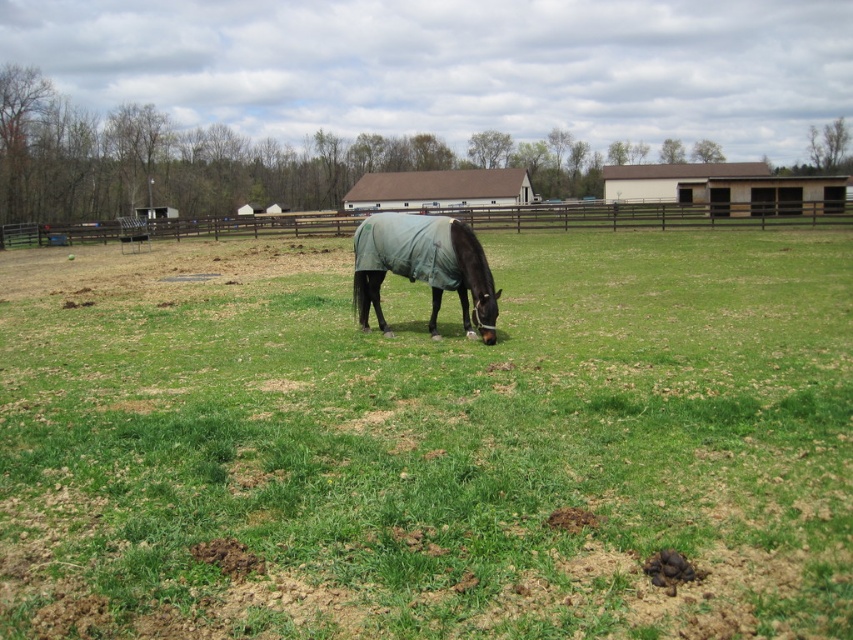
Question: Among these points, which one is nearest to the camera?

Choices:
 (A) [712, 268]
 (B) [364, 260]

Answer: (B)

Question: Which of the following is the closest to the observer?

Choices:
 (A) (494, 316)
 (B) (598, 349)

Answer: (B)

Question: Is green matte horse at center to the right of dark green fabric horse at center from the viewer's perspective?

Choices:
 (A) yes
 (B) no

Answer: (B)

Question: Does green matte horse at center have a lesser width compared to dark green fabric horse at center?

Choices:
 (A) yes
 (B) no

Answer: (B)

Question: From the image, what is the correct spatial relationship of green matte horse at center in relation to dark green fabric horse at center?

Choices:
 (A) right
 (B) left

Answer: (B)